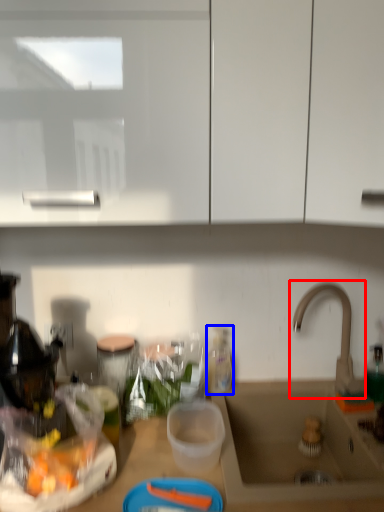
Question: Which object is closer to the camera taking this photo, tap (highlighted by a red box) or bottle (highlighted by a blue box)?

Choices:
 (A) tap
 (B) bottle

Answer: (A)